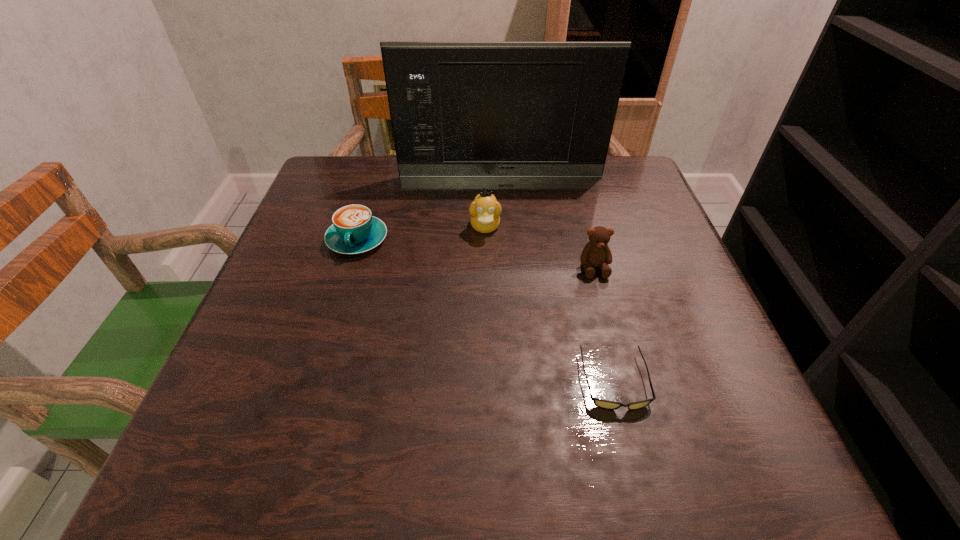
Locate an element on the screen. The image size is (960, 540). vacant area that lies between the microwave oven and the nearest object is located at coordinates (558, 279).

I want to click on vacant area that lies between the sunglasses and the microwave oven, so click(x=558, y=279).

Locate an element on the screen. The width and height of the screenshot is (960, 540). object that can be found as the third closest to the sunglasses is located at coordinates (354, 230).

Select which object appears as the closest to the nearest object. Please provide its 2D coordinates. Your answer should be formatted as a tuple, i.e. [(x, y)], where the tuple contains the x and y coordinates of a point satisfying the conditions above.

[(596, 252)]